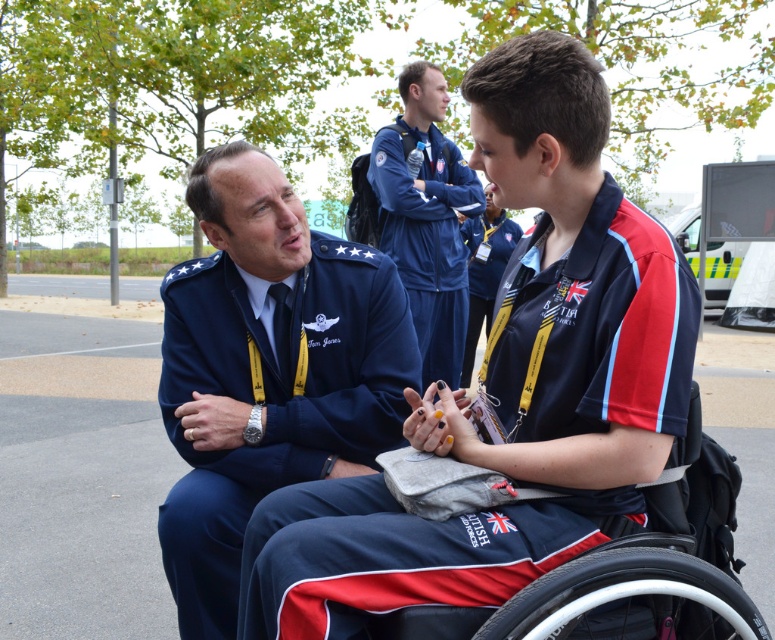
Does blue fabric tracksuit at upper center appear on the left side of blue fabric jacket at center?

Indeed, blue fabric tracksuit at upper center is positioned on the left side of blue fabric jacket at center.

Can you confirm if blue fabric tracksuit at upper center is taller than blue fabric jacket at center?

Correct, blue fabric tracksuit at upper center is much taller as blue fabric jacket at center.

Who is more forward, (x=405, y=282) or (x=467, y=323)?

Point (x=405, y=282) is in front.

The width and height of the screenshot is (775, 640). In order to click on blue fabric tracksuit at upper center in this screenshot , I will do `click(426, 218)`.

Is blue fabric shirt at center to the left of blue fabric jacket at center from the viewer's perspective?

Correct, you'll find blue fabric shirt at center to the left of blue fabric jacket at center.

Identify the location of blue fabric shirt at center. This screenshot has height=640, width=775. point(386,556).

You are a GUI agent. You are given a task and a screenshot of the screen. Output one action in this format:
    pyautogui.click(x=<x>, y=<y>)
    Task: Click on the blue fabric shirt at center
    The width and height of the screenshot is (775, 640).
    Given the screenshot: What is the action you would take?
    pyautogui.click(x=386, y=556)

Is blue fabric shirt at center closer to camera compared to black plastic wheelchair at lower center?

No, it is not.

Who is more forward, (441,417) or (558,602)?

Point (558,602)

Where is `blue fabric shirt at center`? The image size is (775, 640). blue fabric shirt at center is located at coordinates (386, 556).